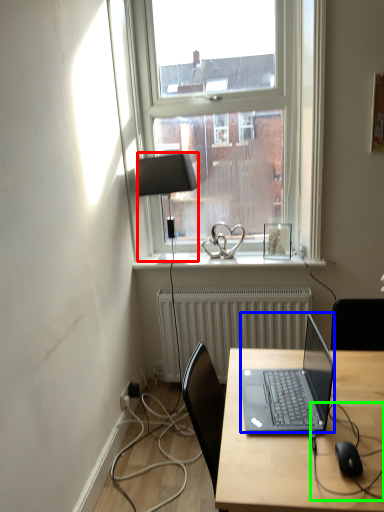
Question: Estimate the real-world distances between objects in this image. Which object is closer to lamp (highlighted by a red box), laptop (highlighted by a blue box) or cable (highlighted by a green box)?

Choices:
 (A) laptop
 (B) cable

Answer: (A)